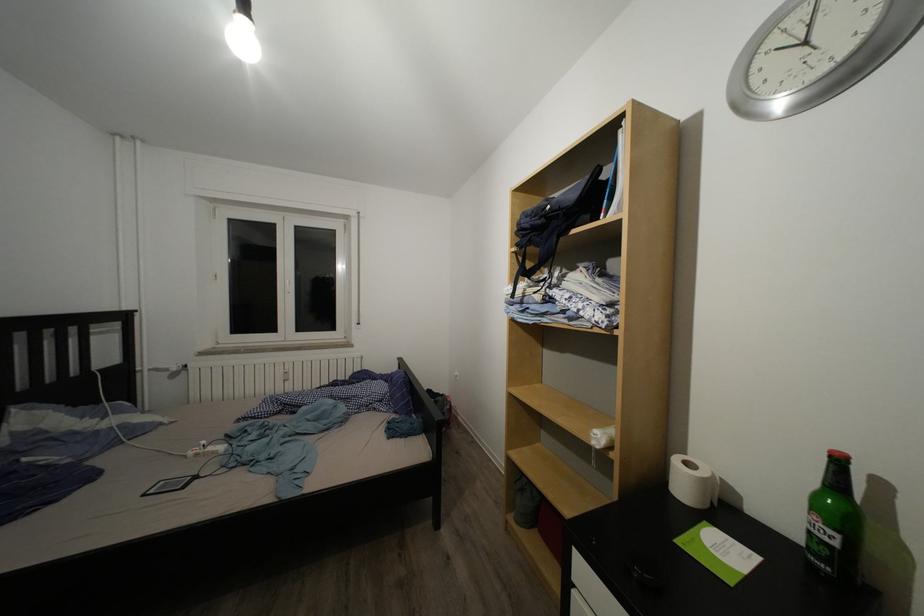
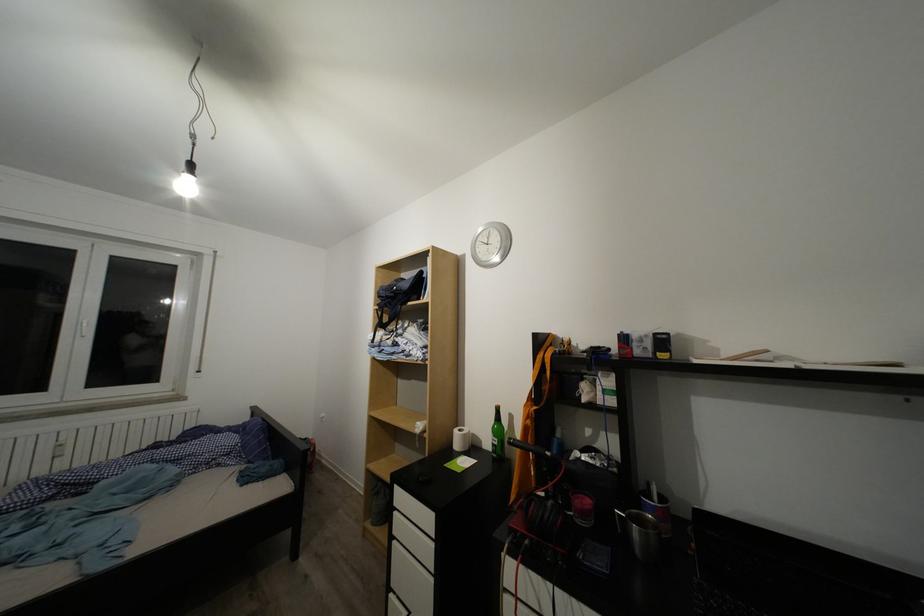
Where in the second image is the point corresponding to the point at 251,51 from the first image?

(193, 195)